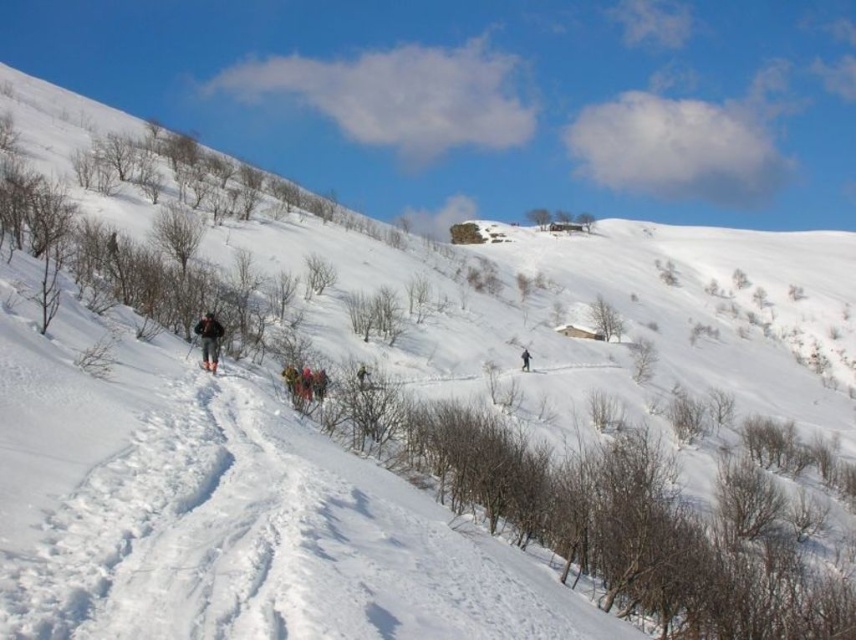
How distant is multicolored fabric group at center from green fabric jacket at center?

multicolored fabric group at center and green fabric jacket at center are 8.01 meters apart.

Who is higher up, multicolored fabric group at center or green fabric jacket at center?

Positioned higher is multicolored fabric group at center.

Does point (295, 371) lie in front of point (367, 381)?

Yes, it is.

The height and width of the screenshot is (640, 856). In order to click on multicolored fabric group at center in this screenshot , I will do `click(304, 384)`.

Can you confirm if green fabric jacket at center is positioned to the right of dark gray snowsuit at center?

In fact, green fabric jacket at center is to the left of dark gray snowsuit at center.

Is point (361, 387) farther from viewer compared to point (522, 348)?

No, it is not.

Which is in front, point (358, 381) or point (526, 368)?

Point (358, 381)

Locate an element on the screen. green fabric jacket at center is located at coordinates (361, 376).

Between multicolored fabric group at center and matte black ski at lower left, which one is positioned higher?

matte black ski at lower left

Can you confirm if multicolored fabric group at center is positioned to the right of matte black ski at lower left?

Indeed, multicolored fabric group at center is positioned on the right side of matte black ski at lower left.

Who is more distant from viewer, (319,394) or (204,371)?

The point (319,394) is more distant.

Locate an element on the screen. This screenshot has width=856, height=640. multicolored fabric group at center is located at coordinates (304, 384).